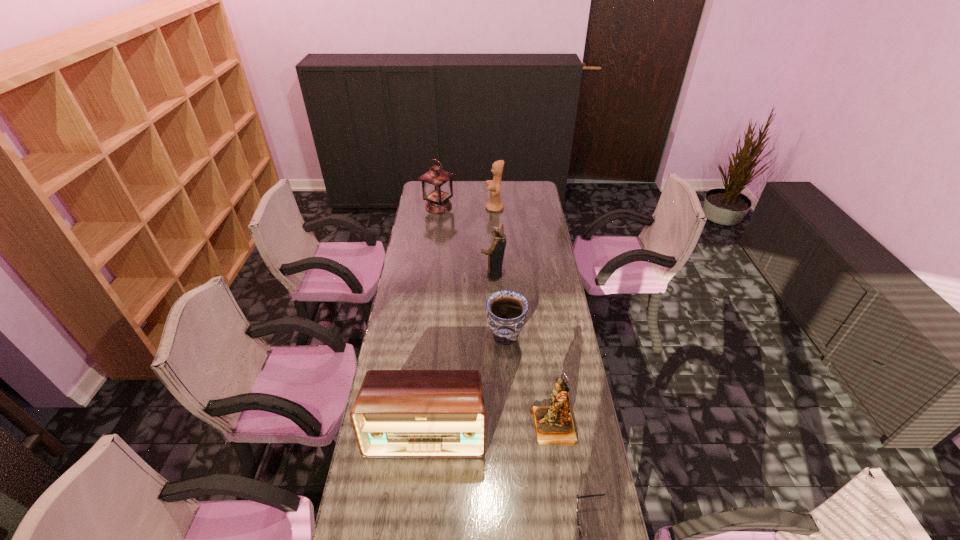
This screenshot has height=540, width=960. Identify the location of vacant space located on the front handle of the fourth nearest object. (x=442, y=336).

Find the location of `object present at the far edge`. object present at the far edge is located at coordinates (437, 188).

The image size is (960, 540). What are the coordinates of `oil lamp located in the left edge section of the desktop` in the screenshot? It's located at (437, 188).

The height and width of the screenshot is (540, 960). I want to click on radio receiver present at the left edge, so click(x=397, y=413).

Where is `object located in the right edge section of the desktop`? Image resolution: width=960 pixels, height=540 pixels. object located in the right edge section of the desktop is located at coordinates (554, 425).

Identify the location of object that is positioned at the far left corner. The image size is (960, 540). (437, 188).

Locate an element on the screen. This screenshot has height=540, width=960. vacant space at the far edge of the desktop is located at coordinates (471, 192).

Where is `vacant space at the left edge of the desktop`? This screenshot has width=960, height=540. vacant space at the left edge of the desktop is located at coordinates (424, 247).

Find the location of a particular element. free spot at the right edge of the desktop is located at coordinates (544, 377).

Locate an element on the screen. free space at the far right corner is located at coordinates (516, 181).